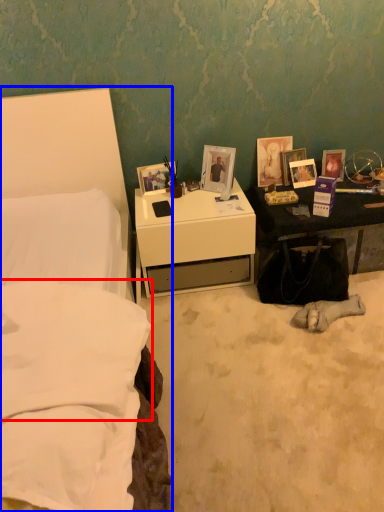
Question: Which object appears farthest to the camera in this image, pillow (highlighted by a red box) or bed (highlighted by a blue box)?

Choices:
 (A) pillow
 (B) bed

Answer: (A)